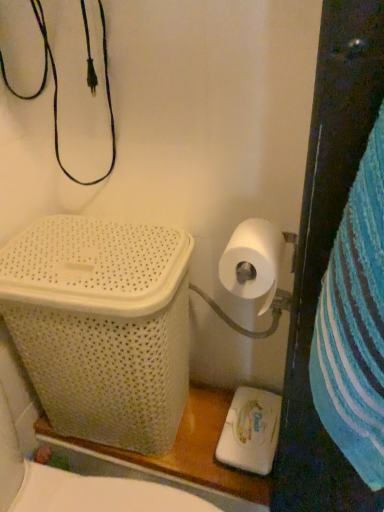
Question: Is white woven laundry basket at left located within white matte toilet paper at right?

Choices:
 (A) yes
 (B) no

Answer: (B)

Question: Is white matte toilet paper at right not close to white woven laundry basket at left?

Choices:
 (A) yes
 (B) no

Answer: (B)

Question: Is white matte toilet paper at right located outside white woven laundry basket at left?

Choices:
 (A) no
 (B) yes

Answer: (B)

Question: Can you confirm if white matte toilet paper at right is smaller than white woven laundry basket at left?

Choices:
 (A) no
 (B) yes

Answer: (B)

Question: Is white matte toilet paper at right shorter than white woven laundry basket at left?

Choices:
 (A) yes
 (B) no

Answer: (A)

Question: From the image's perspective, would you say white matte toilet paper at right is shown under white woven laundry basket at left?

Choices:
 (A) no
 (B) yes

Answer: (A)

Question: From a real-world perspective, is white woven laundry basket at left under white matte toilet paper at right?

Choices:
 (A) yes
 (B) no

Answer: (A)

Question: Is white woven laundry basket at left shorter than white matte toilet paper at right?

Choices:
 (A) no
 (B) yes

Answer: (A)

Question: Is white woven laundry basket at left facing away from white matte toilet paper at right?

Choices:
 (A) no
 (B) yes

Answer: (A)

Question: Is white matte toilet paper at right surrounded by white woven laundry basket at left?

Choices:
 (A) yes
 (B) no

Answer: (B)

Question: Would you consider white woven laundry basket at left to be distant from white matte toilet paper at right?

Choices:
 (A) yes
 (B) no

Answer: (B)

Question: From a real-world perspective, is white woven laundry basket at left located higher than white matte toilet paper at right?

Choices:
 (A) yes
 (B) no

Answer: (B)

Question: Which is correct: white matte toilet paper at right is inside white woven laundry basket at left, or outside of it?

Choices:
 (A) outside
 (B) inside

Answer: (A)